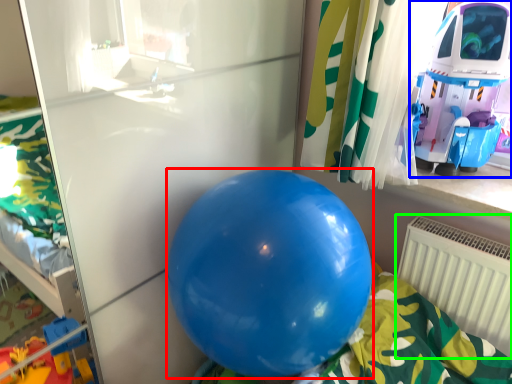
Question: Estimate the real-world distances between objects in this image. Which object is closer to balloon (highlighted by a red box), toy (highlighted by a blue box) or radiator (highlighted by a green box)?

Choices:
 (A) toy
 (B) radiator

Answer: (B)